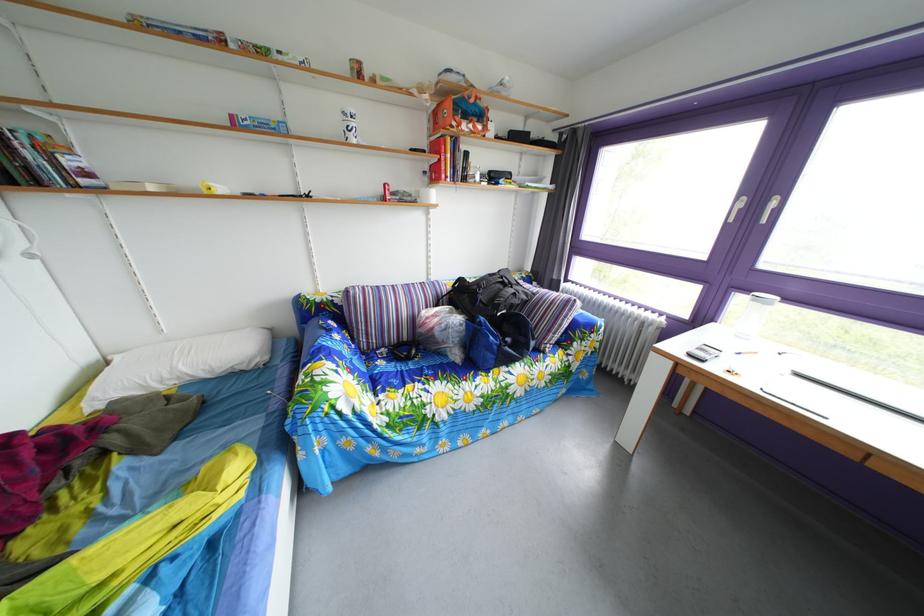
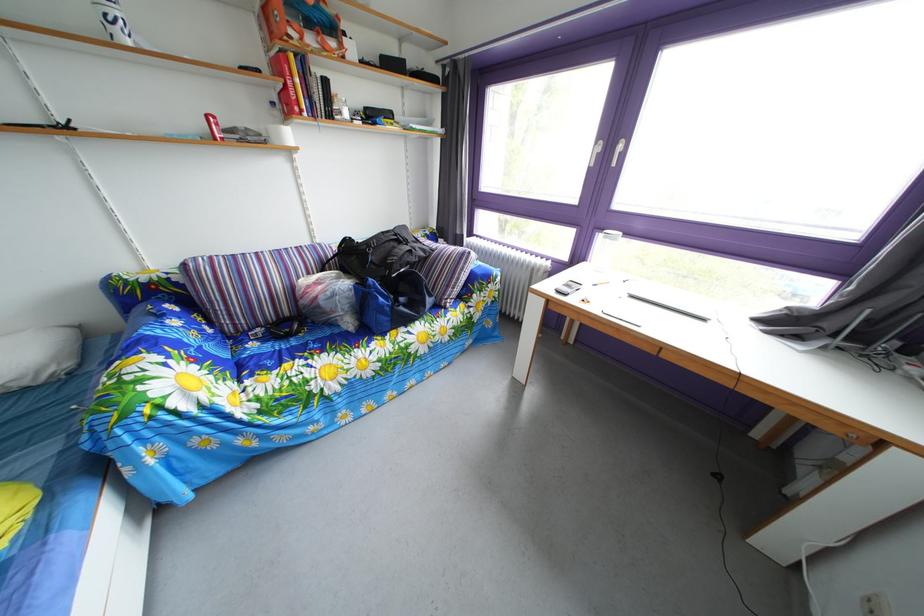
The point at [435,180] is marked in the first image. Where is the corresponding point in the second image?

(284, 111)